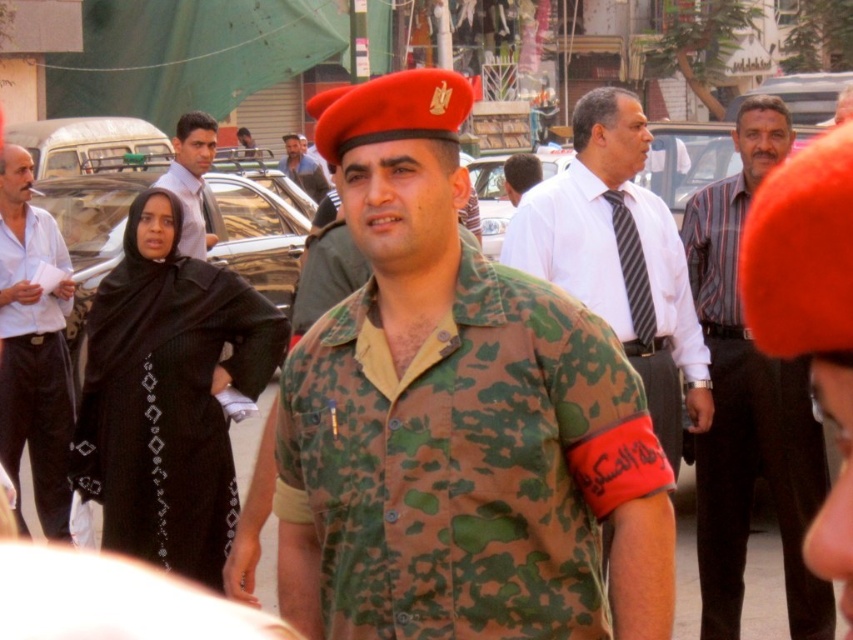
Does camouflage fabric shirt at center appear on the right side of matte black tie at center?

In fact, camouflage fabric shirt at center is to the left of matte black tie at center.

In the scene shown: Who is more distant from viewer, (314, 465) or (538, 172)?

The point (538, 172) is behind.

What are the coordinates of `camouflage fabric shirt at center` in the screenshot? It's located at coord(463,461).

Can you confirm if camouflage fabric shirt at center is positioned above striped cotton shirt at center?

No, camouflage fabric shirt at center is not above striped cotton shirt at center.

Is camouflage fabric shirt at center smaller than striped cotton shirt at center?

No.

Does point (444, 538) lie in front of point (798, 589)?

Yes, point (444, 538) is closer to viewer.

Where is `camouflage fabric shirt at center`? The width and height of the screenshot is (853, 640). camouflage fabric shirt at center is located at coordinates (463, 461).

Is matte white shirt at upper left smaller than matte black tie at center?

Correct, matte white shirt at upper left occupies less space than matte black tie at center.

Can you confirm if matte white shirt at upper left is positioned to the right of matte black tie at center?

Incorrect, matte white shirt at upper left is not on the right side of matte black tie at center.

The width and height of the screenshot is (853, 640). What are the coordinates of `matte white shirt at upper left` in the screenshot? It's located at point(190,179).